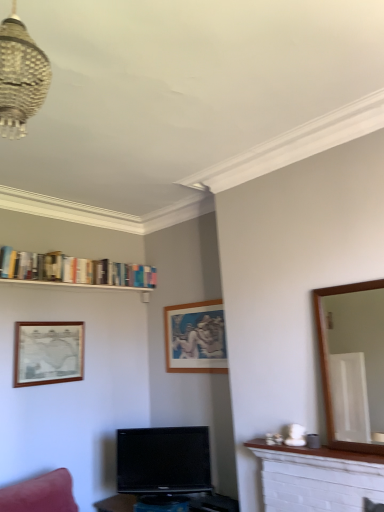
Question: Relative to wooden picture frame at left, arranged as the 2th picture frame when viewed from the right, is black glossy tv at center in front or behind?

Choices:
 (A) front
 (B) behind

Answer: (A)

Question: Considering the positions of point (147, 475) and point (72, 348), is point (147, 475) closer or farther from the camera than point (72, 348)?

Choices:
 (A) farther
 (B) closer

Answer: (B)

Question: Which object is the farthest from the brown wooden mirror at right?

Choices:
 (A) wooden picture frame at center, acting as the 1th picture frame starting from the right
 (B) hardcover books at upper left
 (C) black glossy tv at center
 (D) white marble mantle at lower right
 (E) metallic woven chandelier at upper left

Answer: (E)

Question: Based on their relative distances, which object is nearer to the hardcover books at upper left?

Choices:
 (A) white brick fireplace at lower right
 (B) black glossy tv at center
 (C) wooden picture frame at left, which is the 1th picture frame in left-to-right order
 (D) wooden picture frame at center, the 2th picture frame from the left
 (E) brown wooden mirror at right

Answer: (C)